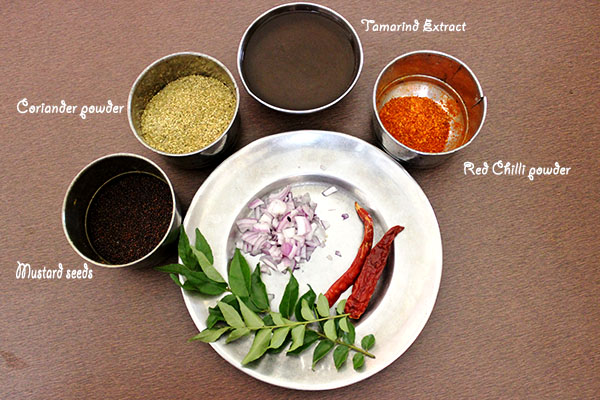
The image size is (600, 400). Identify the location of plant. (235, 337).